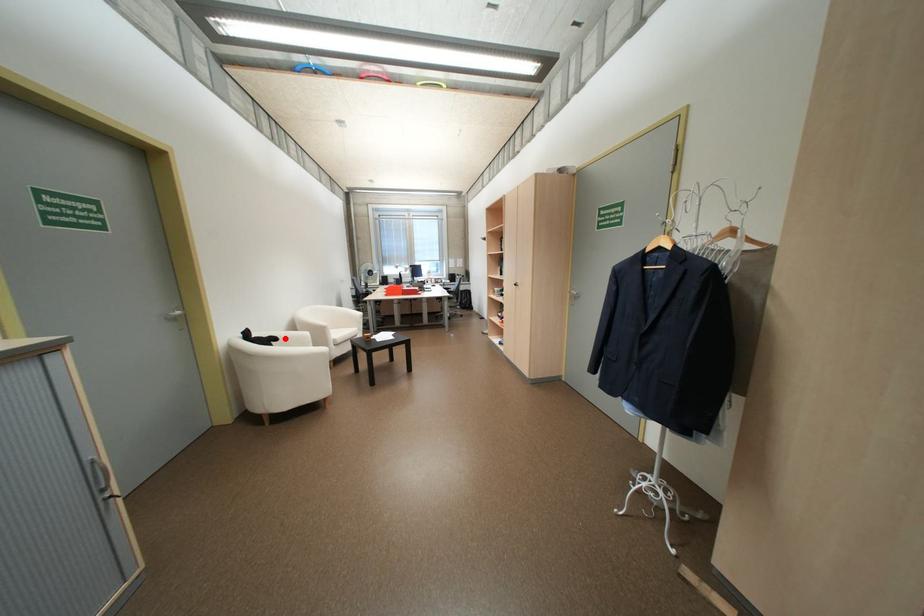
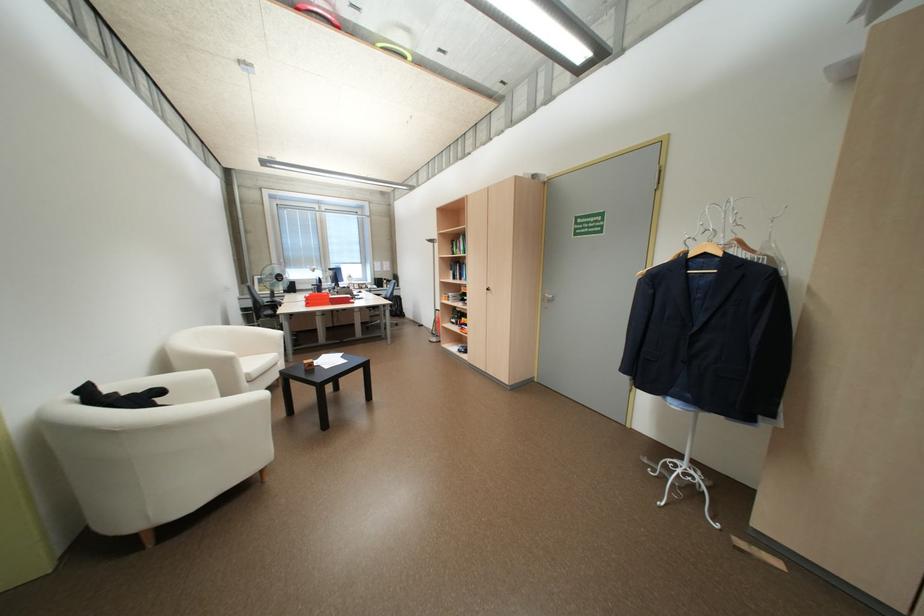
Where in the second image is the point corresponding to the highlighted location from the first image?

(169, 392)